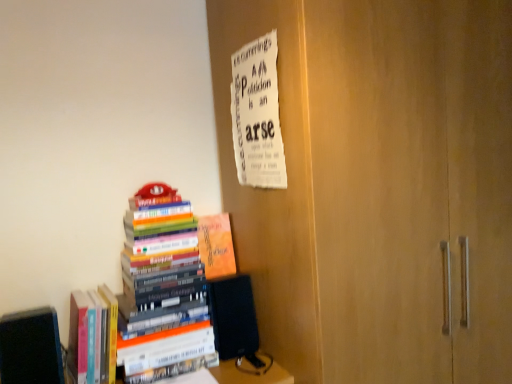
Describe the element at coordinates (216, 245) in the screenshot. I see `orange matte book at center, which appears as the 1th book when viewed from the right` at that location.

What is the approximate width of hardcover books at left, which is counted as the third book, starting from the left?

It is 11.76 inches.

What is the approximate height of black matte book at lower left, marked as the first book in a left-to-right arrangement?

black matte book at lower left, marked as the first book in a left-to-right arrangement, is 10.08 inches in height.

Describe the element at coordinates (79, 335) in the screenshot. The image size is (512, 384). I see `hardcover books at left, which appears as the 3th book when viewed from the right` at that location.

The width and height of the screenshot is (512, 384). Identify the location of orange matte book at center, the 4th book positioned from the left. (216, 245).

Which of these two, hardcover books at left, which appears as the 3th book when viewed from the right, or black matte book at lower left, marked as the first book in a left-to-right arrangement, is thinner?

black matte book at lower left, marked as the first book in a left-to-right arrangement.

From a real-world perspective, is hardcover books at left, the second book in the left-to-right sequence, below black matte book at lower left, the 4th book viewed from the right?

Indeed, from a real-world perspective, hardcover books at left, the second book in the left-to-right sequence, is positioned beneath black matte book at lower left, the 4th book viewed from the right.

Would you say hardcover books at left, which appears as the 3th book when viewed from the right, is outside black matte book at lower left, the 4th book viewed from the right?

Indeed, hardcover books at left, which appears as the 3th book when viewed from the right, is completely outside black matte book at lower left, the 4th book viewed from the right.

How far apart are hardcover books at left, the second book in the left-to-right sequence, and black matte book at lower left, the 4th book viewed from the right?

hardcover books at left, the second book in the left-to-right sequence, is 4.52 inches from black matte book at lower left, the 4th book viewed from the right.

Is point (37, 322) positioned behind point (76, 335)?

No, (37, 322) is in front of (76, 335).

From the image's perspective, which is above, black matte book at lower left, the 4th book viewed from the right, or hardcover books at left, the second book in the left-to-right sequence?

hardcover books at left, the second book in the left-to-right sequence.

Is black matte book at lower left, the 4th book viewed from the right, placed right next to hardcover books at left, which appears as the 3th book when viewed from the right?

No, black matte book at lower left, the 4th book viewed from the right, is not beside hardcover books at left, which appears as the 3th book when viewed from the right.

Considering the sizes of objects black matte book at lower left, the 4th book viewed from the right, and hardcover books at left, the second book in the left-to-right sequence, in the image provided, who is bigger, black matte book at lower left, the 4th book viewed from the right, or hardcover books at left, the second book in the left-to-right sequence,?

Bigger between the two is black matte book at lower left, the 4th book viewed from the right.

Consider the image. Is white paper at upper center facing towards orange matte book at center, which appears as the 1th book when viewed from the right?

No, white paper at upper center is not turned towards orange matte book at center, which appears as the 1th book when viewed from the right.

Considering the relative sizes of white paper at upper center and orange matte book at center, which appears as the 1th book when viewed from the right, in the image provided, is white paper at upper center wider than orange matte book at center, which appears as the 1th book when viewed from the right,?

Incorrect, the width of white paper at upper center does not surpass that of orange matte book at center, which appears as the 1th book when viewed from the right.

From the image's perspective, is white paper at upper center over orange matte book at center, the 4th book positioned from the left?

Correct, white paper at upper center appears higher than orange matte book at center, the 4th book positioned from the left, in the image.

Is white paper at upper center inside the boundaries of orange matte book at center, the 4th book positioned from the left, or outside?

white paper at upper center cannot be found inside orange matte book at center, the 4th book positioned from the left.

Considering the sizes of objects hardcover books at left, the second book in the left-to-right sequence, and orange matte book at center, which appears as the 1th book when viewed from the right, in the image provided, who is bigger, hardcover books at left, the second book in the left-to-right sequence, or orange matte book at center, which appears as the 1th book when viewed from the right,?

With larger size is hardcover books at left, the second book in the left-to-right sequence.

Is point (96, 301) closer to camera compared to point (231, 259)?

Yes, it is in front of point (231, 259).

Looking at this image, could you measure the distance between hardcover books at left, the second book in the left-to-right sequence, and orange matte book at center, which appears as the 1th book when viewed from the right?

The distance of hardcover books at left, the second book in the left-to-right sequence, from orange matte book at center, which appears as the 1th book when viewed from the right, is 16.28 inches.

Considering the sizes of hardcover books at left, which appears as the 3th book when viewed from the right, and white paper at upper center in the image, is hardcover books at left, which appears as the 3th book when viewed from the right, bigger or smaller than white paper at upper center?

Clearly, hardcover books at left, which appears as the 3th book when viewed from the right, is larger in size than white paper at upper center.

Could you tell me if hardcover books at left, the second book in the left-to-right sequence, is facing white paper at upper center?

No, hardcover books at left, the second book in the left-to-right sequence, is not turned towards white paper at upper center.

From the image's perspective, count 3rd books downward from the white paper at upper center and point to it. Please provide its 2D coordinates.

[(79, 335)]

From a real-world perspective, is hardcover books at left, the second book in the left-to-right sequence, above or below white paper at upper center?

Clearly, from a real-world perspective, hardcover books at left, the second book in the left-to-right sequence, is below white paper at upper center.

Starting from the hardcover books at left, the second book in the left-to-right sequence, which book is the 2nd one to the right? Please provide its 2D coordinates.

[(216, 245)]

Would you say orange matte book at center, the 4th book positioned from the left, is a long distance from hardcover books at left, which appears as the 3th book when viewed from the right?

That's not correct — orange matte book at center, the 4th book positioned from the left, is a little close to hardcover books at left, which appears as the 3th book when viewed from the right.

Which of these two, orange matte book at center, which appears as the 1th book when viewed from the right, or hardcover books at left, which appears as the 3th book when viewed from the right, is smaller?

orange matte book at center, which appears as the 1th book when viewed from the right, is smaller.

Is orange matte book at center, the 4th book positioned from the left, oriented towards hardcover books at left, which appears as the second book when viewed from the right?

No, orange matte book at center, the 4th book positioned from the left, is not turned towards hardcover books at left, which appears as the second book when viewed from the right.

From the image's perspective, which one is positioned higher, orange matte book at center, which appears as the 1th book when viewed from the right, or hardcover books at left, which is counted as the third book, starting from the left?

orange matte book at center, which appears as the 1th book when viewed from the right.

Does orange matte book at center, the 4th book positioned from the left, have a lesser width compared to hardcover books at left, which appears as the second book when viewed from the right?

Yes.

Who is shorter, orange matte book at center, the 4th book positioned from the left, or hardcover books at left, which appears as the second book when viewed from the right?

orange matte book at center, the 4th book positioned from the left, is shorter.

Starting from the hardcover books at left, which appears as the 3th book when viewed from the right, which book is the 2nd one in front? Please provide its 2D coordinates.

[(31, 347)]

Image resolution: width=512 pixels, height=384 pixels. I want to click on the 1st book counting from the right of the black matte book at lower left, marked as the first book in a left-to-right arrangement, so click(79, 335).

Based on their spatial positions, is black matte book at lower left, marked as the first book in a left-to-right arrangement, or hardcover books at left, which appears as the second book when viewed from the right, closer to orange matte book at center, which appears as the 1th book when viewed from the right?

hardcover books at left, which appears as the second book when viewed from the right, lies closer to orange matte book at center, which appears as the 1th book when viewed from the right, than the other object.

Looking at the image, which one is located closer to hardcover books at left, the second book in the left-to-right sequence, black matte book at lower left, the 4th book viewed from the right, or white paper at upper center?

black matte book at lower left, the 4th book viewed from the right, is positioned closer to the anchor hardcover books at left, the second book in the left-to-right sequence.

Which object lies nearer to the anchor point hardcover books at left, the second book in the left-to-right sequence, hardcover books at left, which appears as the second book when viewed from the right, or orange matte book at center, the 4th book positioned from the left?

hardcover books at left, which appears as the second book when viewed from the right, is closer to hardcover books at left, the second book in the left-to-right sequence.

When comparing their distances from hardcover books at left, which appears as the 3th book when viewed from the right, does white paper at upper center or black matte book at lower left, the 4th book viewed from the right, seem closer?

black matte book at lower left, the 4th book viewed from the right, is closer to hardcover books at left, which appears as the 3th book when viewed from the right.

Based on their spatial positions, is white paper at upper center or orange matte book at center, which appears as the 1th book when viewed from the right, further from black matte book at lower left, marked as the first book in a left-to-right arrangement?

The object further to black matte book at lower left, marked as the first book in a left-to-right arrangement, is white paper at upper center.

When comparing their distances from white paper at upper center, does orange matte book at center, which appears as the 1th book when viewed from the right, or hardcover books at left, which is counted as the third book, starting from the left, seem further?

The object further to white paper at upper center is hardcover books at left, which is counted as the third book, starting from the left.

From the image, which object appears to be nearer to black matte book at lower left, marked as the first book in a left-to-right arrangement, hardcover books at left, which appears as the 3th book when viewed from the right, or hardcover books at left, which appears as the second book when viewed from the right?

hardcover books at left, which appears as the 3th book when viewed from the right, lies closer to black matte book at lower left, marked as the first book in a left-to-right arrangement, than the other object.

Considering their positions, is white paper at upper center positioned further to orange matte book at center, the 4th book positioned from the left, than black matte book at lower left, the 4th book viewed from the right?

black matte book at lower left, the 4th book viewed from the right, is positioned further to the anchor orange matte book at center, the 4th book positioned from the left.

Find the location of a particular element. book between white paper at upper center and hardcover books at left, which appears as the second book when viewed from the right, from top to bottom is located at coordinates (216, 245).

Locate an element on the screen. book between hardcover books at left, the second book in the left-to-right sequence, and orange matte book at center, which appears as the 1th book when viewed from the right, in the horizontal direction is located at coordinates (156, 280).

The image size is (512, 384). I want to click on book between black matte book at lower left, marked as the first book in a left-to-right arrangement, and hardcover books at left, which appears as the second book when viewed from the right, in the horizontal direction, so click(x=79, y=335).